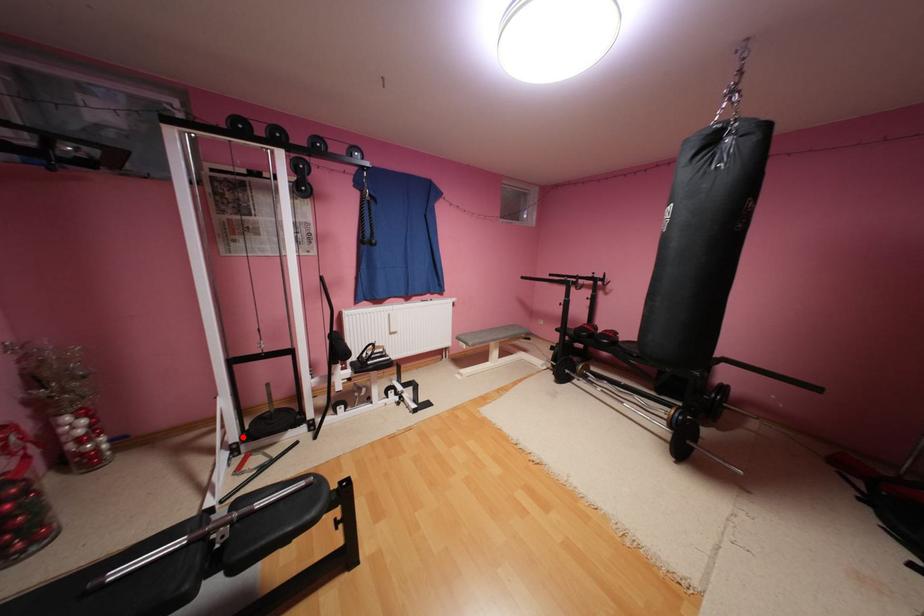
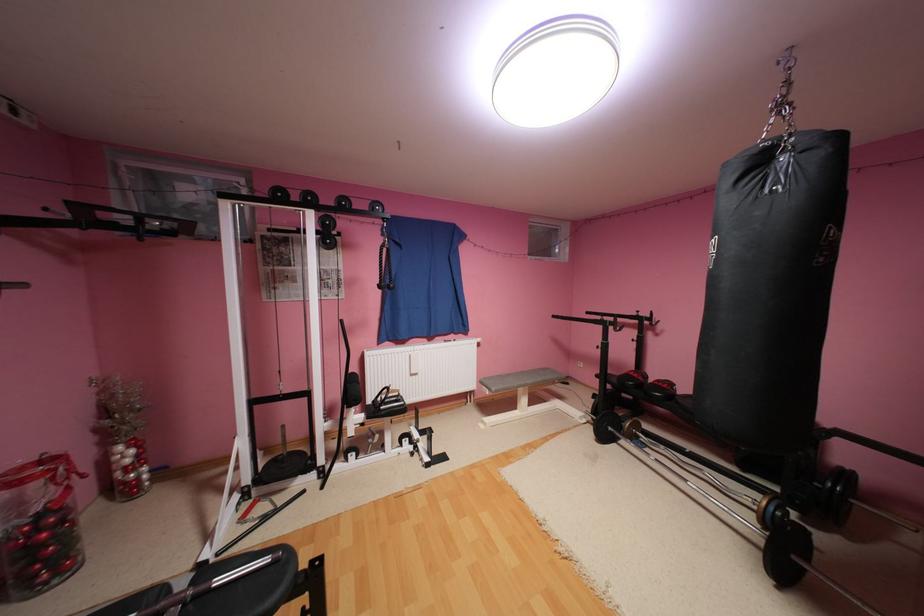
Question: I am providing you with two images of the same scene from different viewpoints. In image1, a red point is highlighted. Considering the same 3D point in image2, which of the following is correct?

Choices:
 (A) It is closer
 (B) It is farther

Answer: (A)